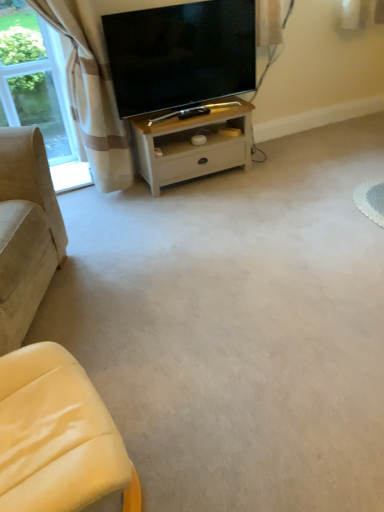
Question: Is matte black tv at upper center further to the viewer compared to clear glass window at upper left?

Choices:
 (A) no
 (B) yes

Answer: (A)

Question: Is matte black tv at upper center closer to the viewer compared to clear glass window at upper left?

Choices:
 (A) no
 (B) yes

Answer: (B)

Question: Can you confirm if matte black tv at upper center is smaller than clear glass window at upper left?

Choices:
 (A) yes
 (B) no

Answer: (B)

Question: From the image's perspective, is matte black tv at upper center located above clear glass window at upper left?

Choices:
 (A) no
 (B) yes

Answer: (B)

Question: Is matte black tv at upper center aimed at clear glass window at upper left?

Choices:
 (A) no
 (B) yes

Answer: (A)

Question: Considering the positions of beige plaid curtain at upper left and beige corduroy couch at left, positioned as the 1th studio couch in left-to-right order, in the image, is beige plaid curtain at upper left taller or shorter than beige corduroy couch at left, positioned as the 1th studio couch in left-to-right order,?

Choices:
 (A) tall
 (B) short

Answer: (A)

Question: Which is correct: beige plaid curtain at upper left is inside beige corduroy couch at left, arranged as the 2th studio couch when viewed from the right, or outside of it?

Choices:
 (A) outside
 (B) inside

Answer: (A)

Question: From the image's perspective, relative to beige corduroy couch at left, positioned as the 1th studio couch in left-to-right order, is beige plaid curtain at upper left above or below?

Choices:
 (A) below
 (B) above

Answer: (B)

Question: Is beige plaid curtain at upper left in front of or behind beige corduroy couch at left, arranged as the 2th studio couch when viewed from the right, in the image?

Choices:
 (A) behind
 (B) front

Answer: (A)

Question: Is matte black tv at upper center to the left or to the right of clear glass window at upper left in the image?

Choices:
 (A) right
 (B) left

Answer: (A)

Question: Is matte black tv at upper center wider or thinner than clear glass window at upper left?

Choices:
 (A) thin
 (B) wide

Answer: (B)

Question: Is matte black tv at upper center inside the boundaries of clear glass window at upper left, or outside?

Choices:
 (A) outside
 (B) inside

Answer: (A)

Question: Considering their positions, is matte black tv at upper center located in front of or behind clear glass window at upper left?

Choices:
 (A) front
 (B) behind

Answer: (A)

Question: From the image's perspective, is white wood table at center positioned above or below beige corduroy couch at left, arranged as the 2th studio couch when viewed from the right?

Choices:
 (A) below
 (B) above

Answer: (B)

Question: Is white wood table at center in front of or behind beige corduroy couch at left, arranged as the 2th studio couch when viewed from the right, in the image?

Choices:
 (A) front
 (B) behind

Answer: (B)